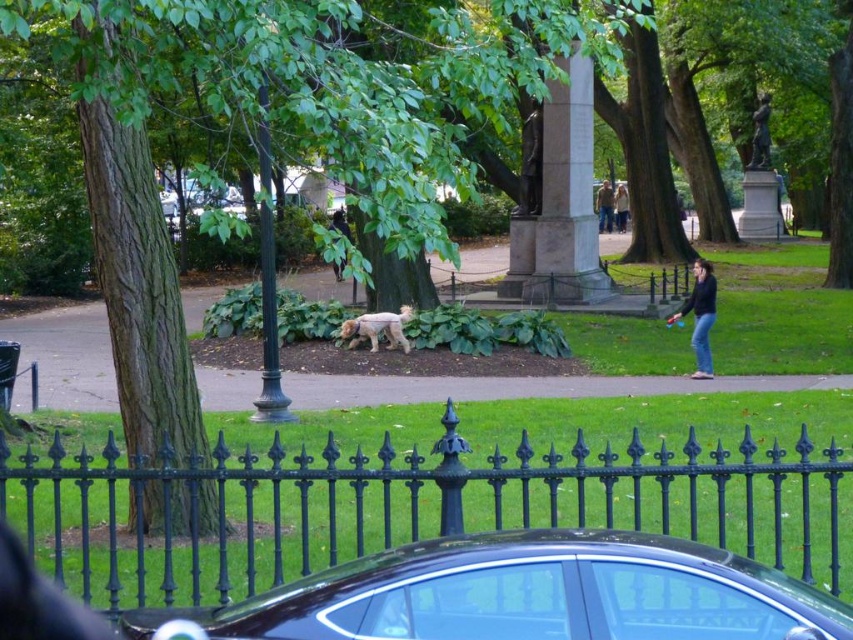
Can you confirm if dark blue jeans at right is smaller than dark brown leather jacket at center?

No, dark blue jeans at right is not smaller than dark brown leather jacket at center.

Is dark blue jeans at right below dark brown leather jacket at center?

Correct, dark blue jeans at right is located below dark brown leather jacket at center.

Is point (704, 317) in front of point (622, 188)?

Yes, it is.

Where is `dark blue jeans at right`? dark blue jeans at right is located at coordinates tap(700, 316).

Is shiny black car at lower center taller than brown leather jacket at center?

No, shiny black car at lower center is not taller than brown leather jacket at center.

From the picture: Does shiny black car at lower center have a greater width compared to brown leather jacket at center?

Incorrect, shiny black car at lower center's width does not surpass brown leather jacket at center's.

What do you see at coordinates (529, 593) in the screenshot? I see `shiny black car at lower center` at bounding box center [529, 593].

Where is `shiny black car at lower center`? shiny black car at lower center is located at coordinates (529, 593).

In the scene shown: Does black wrought iron fence at center have a greater height compared to shiny black car at lower center?

In fact, black wrought iron fence at center may be shorter than shiny black car at lower center.

Identify the location of black wrought iron fence at center. This screenshot has height=640, width=853. (426, 506).